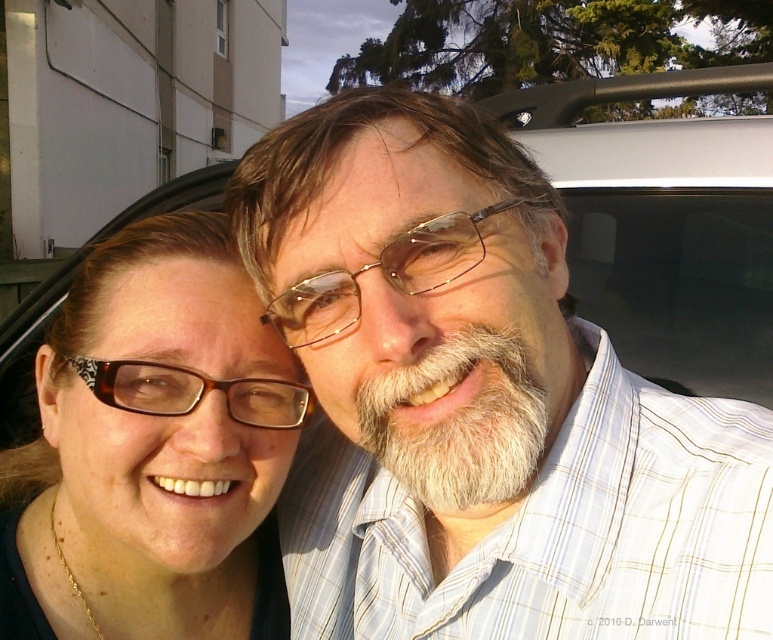
Does white striped shirt at center have a smaller size compared to transparent glass car window at upper center?

Incorrect, white striped shirt at center is not smaller in size than transparent glass car window at upper center.

Is point (455, 352) closer to viewer compared to point (751, 305)?

Yes, point (455, 352) is closer to viewer.

This screenshot has height=640, width=773. Identify the location of white striped shirt at center. (479, 403).

Can you confirm if matte black glasses at left is bigger than metallic gold glasses at center?

Correct, matte black glasses at left is larger in size than metallic gold glasses at center.

Can you confirm if matte black glasses at left is positioned below metallic gold glasses at center?

Indeed, matte black glasses at left is positioned under metallic gold glasses at center.

Where is `matte black glasses at left`? The image size is (773, 640). matte black glasses at left is located at coordinates (152, 451).

Who is more distant from viewer, [368,340] or [397,248]?

The point [368,340] is more distant.

Is the position of white striped shirt at center more distant than that of metallic gold glasses at center?

No, it is in front of metallic gold glasses at center.

Is point (312, 435) more distant than point (441, 250)?

Yes, it is.

Identify the location of white striped shirt at center. (479, 403).